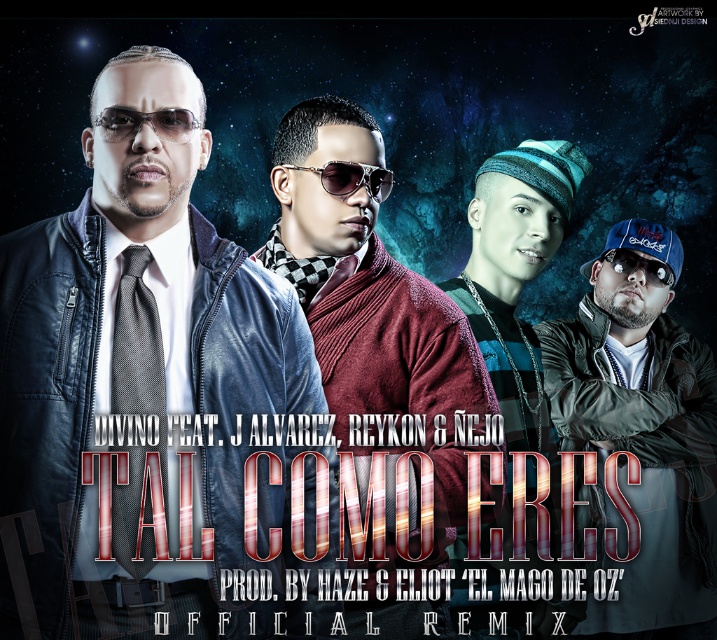
You are a photographer setting up a camera 10 feet away from the green matte jacket at center and sunglasses at center. Can you capture both items in a single frame without moving the camera? Explain your reasoning.

The green matte jacket at center and sunglasses at center are 7.31 feet apart. Since the camera is positioned 10 feet away from both items, the distance between them is less than the camera frame width at that distance, so yes, both items can be captured in a single frame without moving the camera.

You are designing a poster layout and need to place a logo between the green matte jacket at center and the sunglasses at center. Which object should the logo be closer to if it needs to be near the larger item?

The logo should be closer to the green matte jacket at center since it is larger than the sunglasses at center.